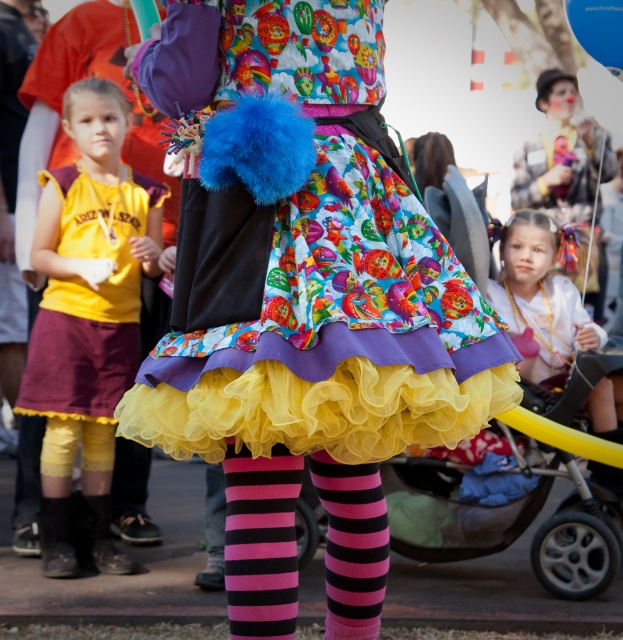
In the scene shown: Does matte yellow dress at center have a smaller size compared to blue fabric balloon at upper right?

No, matte yellow dress at center is not smaller than blue fabric balloon at upper right.

Does matte yellow dress at center appear on the right side of blue fabric balloon at upper right?

Indeed, matte yellow dress at center is positioned on the right side of blue fabric balloon at upper right.

Does point (520, 195) come closer to viewer compared to point (606, 38)?

No.

The image size is (623, 640). Find the location of `matte yellow dress at center`. matte yellow dress at center is located at coordinates (559, 156).

Consider the image. Between yellow jersey at left and yellow fabric baby carriage at lower center, which one has less height?

Standing shorter between the two is yellow fabric baby carriage at lower center.

I want to click on yellow jersey at left, so click(87, 316).

Find the location of a particular element. The height and width of the screenshot is (640, 623). yellow jersey at left is located at coordinates (87, 316).

I want to click on yellow jersey at left, so click(87, 316).

Can you confirm if pastel hairband at upper center is positioned below matte yellow dress at center?

Yes, pastel hairband at upper center is below matte yellow dress at center.

Does pastel hairband at upper center have a lesser height compared to matte yellow dress at center?

Yes.

Find the location of `pastel hairband at upper center`. pastel hairband at upper center is located at coordinates (540, 298).

I want to click on pastel hairband at upper center, so click(540, 298).